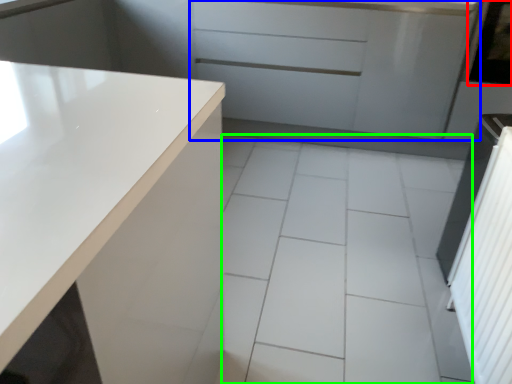
Question: Which object is positioned closest to window screen (highlighted by a red box)? Select from cabinetry (highlighted by a blue box) and ceramic tile (highlighted by a green box).

Choices:
 (A) cabinetry
 (B) ceramic tile

Answer: (A)